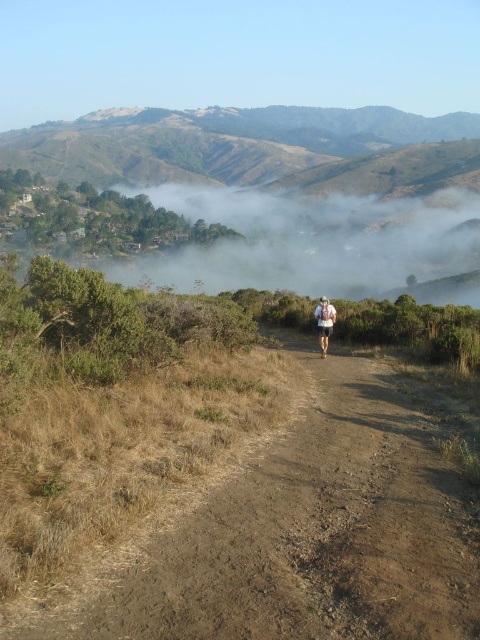
Question: Which of the following is the closest to the observer?

Choices:
 (A) (132, 618)
 (B) (334, 308)

Answer: (A)

Question: Can you confirm if brown dirt track at center is wider than white fabric at center?

Choices:
 (A) yes
 (B) no

Answer: (A)

Question: Which object appears closest to the camera in this image?

Choices:
 (A) white fabric at center
 (B) brown dirt track at center

Answer: (B)

Question: Can you confirm if brown dirt track at center is smaller than white fabric at center?

Choices:
 (A) yes
 (B) no

Answer: (B)

Question: Does brown dirt track at center appear under white fabric at center?

Choices:
 (A) yes
 (B) no

Answer: (A)